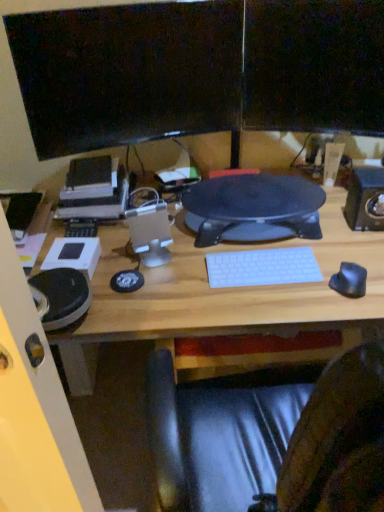
You are a GUI agent. You are given a task and a screenshot of the screen. Output one action in this format:
    pyautogui.click(x=<x>, y=<y>)
    Task: Click on the vacant area situated to the left side of black plastic speaker at right, the 1th speaker from the right
    The image size is (384, 512).
    Given the screenshot: What is the action you would take?
    pyautogui.click(x=333, y=232)